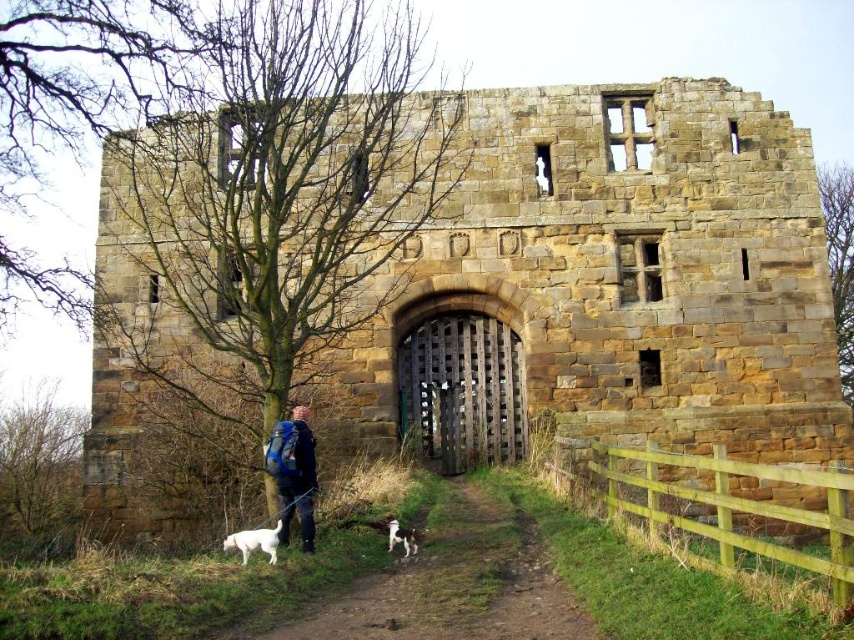
Question: Where is brown stone gate at center located in relation to white fur dog at lower left in the image?

Choices:
 (A) below
 (B) above

Answer: (B)

Question: Is green wooden fence at lower right to the right of wooden gate at center from the viewer's perspective?

Choices:
 (A) no
 (B) yes

Answer: (B)

Question: Is brown dirt path at lower center above green wooden fence at lower right?

Choices:
 (A) yes
 (B) no

Answer: (B)

Question: Which of these objects is positioned closest to the brown dirt path at lower center?

Choices:
 (A) green wooden fence at lower right
 (B) blue backpack at lower left

Answer: (B)

Question: Which of the following is the closest to the observer?

Choices:
 (A) white fur dog at lower left
 (B) wooden gate at center
 (C) white fur dog at lower center

Answer: (A)

Question: Which point is closer to the camera?

Choices:
 (A) (237, 541)
 (B) (504, 611)
 (C) (384, 348)
 (D) (285, 448)

Answer: (B)